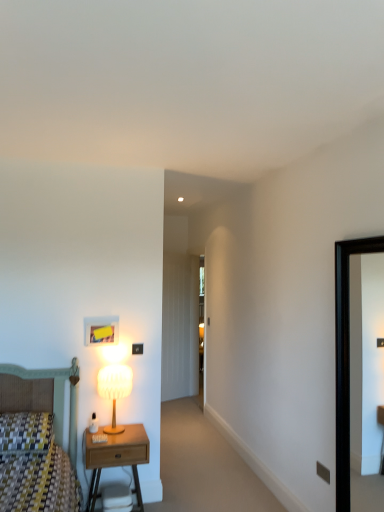
Question: Does transparent glass door at center have a larger size compared to matte white lamp at left?

Choices:
 (A) yes
 (B) no

Answer: (A)

Question: Does transparent glass door at center have a greater width compared to matte white lamp at left?

Choices:
 (A) no
 (B) yes

Answer: (A)

Question: Is transparent glass door at center behind matte white lamp at left?

Choices:
 (A) no
 (B) yes

Answer: (B)

Question: Is transparent glass door at center oriented towards matte white lamp at left?

Choices:
 (A) yes
 (B) no

Answer: (B)

Question: From a real-world perspective, is transparent glass door at center on top of matte white lamp at left?

Choices:
 (A) yes
 (B) no

Answer: (A)

Question: Is transparent glass door at center to the left or to the right of wooden nightstand at lower left in the image?

Choices:
 (A) right
 (B) left

Answer: (A)

Question: Is transparent glass door at center wider or thinner than wooden nightstand at lower left?

Choices:
 (A) wide
 (B) thin

Answer: (B)

Question: Relative to wooden nightstand at lower left, is transparent glass door at center in front or behind?

Choices:
 (A) behind
 (B) front

Answer: (A)

Question: From the image's perspective, is transparent glass door at center positioned above or below wooden nightstand at lower left?

Choices:
 (A) below
 (B) above

Answer: (B)

Question: Relative to black glossy picture frame at right, is matte black electric outlet at lower right in front or behind?

Choices:
 (A) front
 (B) behind

Answer: (B)

Question: From the image's perspective, is matte black electric outlet at lower right above or below black glossy picture frame at right?

Choices:
 (A) above
 (B) below

Answer: (B)

Question: From a real-world perspective, is matte black electric outlet at lower right above or below black glossy picture frame at right?

Choices:
 (A) above
 (B) below

Answer: (B)

Question: From their relative heights in the image, would you say matte black electric outlet at lower right is taller or shorter than black glossy picture frame at right?

Choices:
 (A) tall
 (B) short

Answer: (B)

Question: Is point (344, 431) positioned closer to the camera than point (140, 429)?

Choices:
 (A) farther
 (B) closer

Answer: (B)

Question: Looking at their shapes, would you say black glossy picture frame at right is wider or thinner than wooden nightstand at lower left?

Choices:
 (A) wide
 (B) thin

Answer: (B)